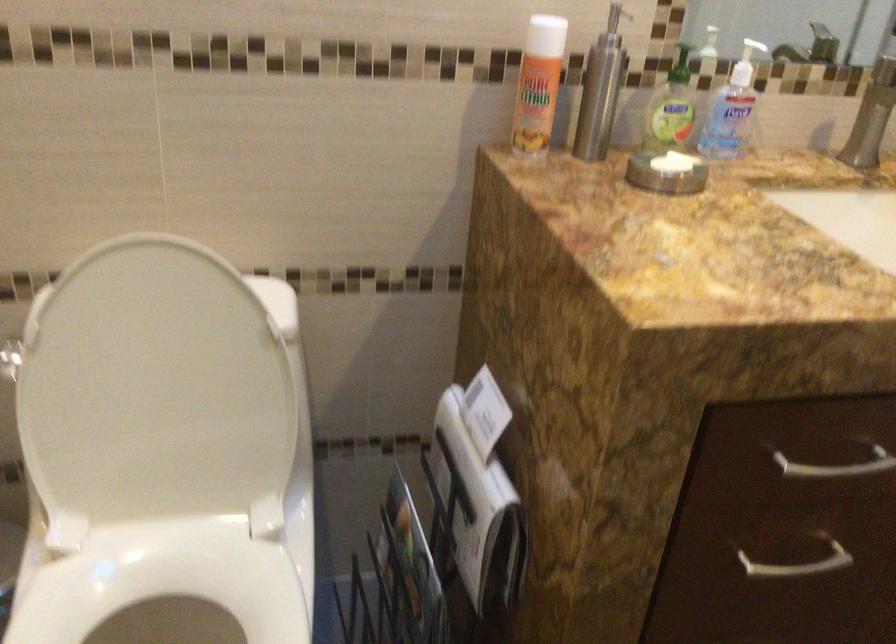
Where is `white dispenser pump`? white dispenser pump is located at coordinates (745, 64).